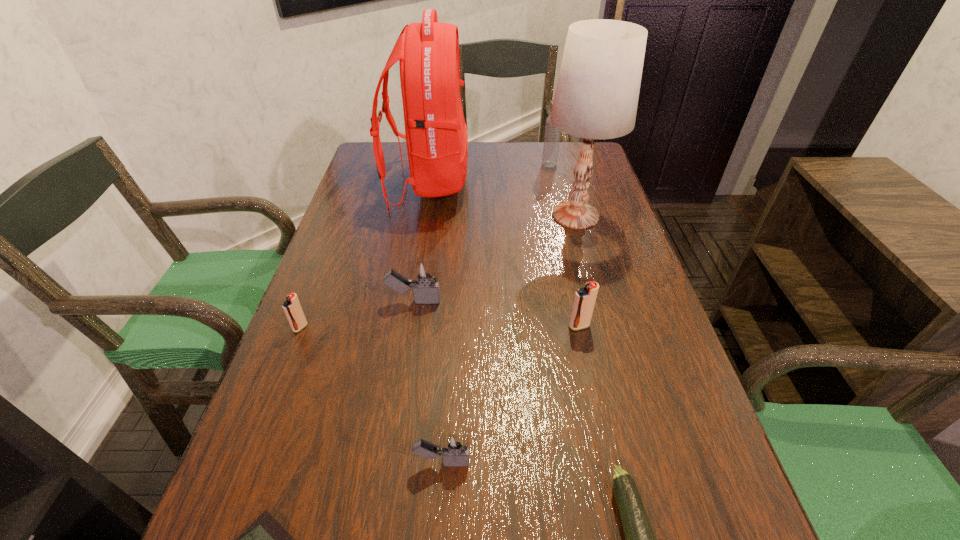
Locate an element on the screen. Image resolution: width=960 pixels, height=540 pixels. the nearer gray igniter is located at coordinates (454, 449).

Where is `the nearest igniter`? The width and height of the screenshot is (960, 540). the nearest igniter is located at coordinates click(454, 449).

At what (x,y) coordinates should I click in order to perform the action: click on free space located on the main compartment of the backpack. Please return your answer as a coordinate pair (x, y). Looking at the image, I should click on pyautogui.click(x=562, y=184).

Locate an element on the screen. The height and width of the screenshot is (540, 960). free region located on the back of the lamp is located at coordinates (567, 187).

Identify the location of vacant space located 0.400m on the front of the blue water bottle. The image size is (960, 540). (568, 249).

At what (x,y) coordinates should I click in order to perform the action: click on vacant position located on the right of the farthest igniter. Please return your answer as a coordinate pair (x, y). This screenshot has width=960, height=540. Looking at the image, I should click on (522, 301).

Image resolution: width=960 pixels, height=540 pixels. What are the coordinates of `vacant region located on the left of the right red igniter` in the screenshot? It's located at (472, 326).

This screenshot has height=540, width=960. Identify the location of vacant space positioned on the right of the leftmost igniter. (336, 328).

The image size is (960, 540). I want to click on vacant space located 0.180m on the left of the nearer gray igniter, so click(302, 462).

I want to click on backpack at the far edge, so click(436, 136).